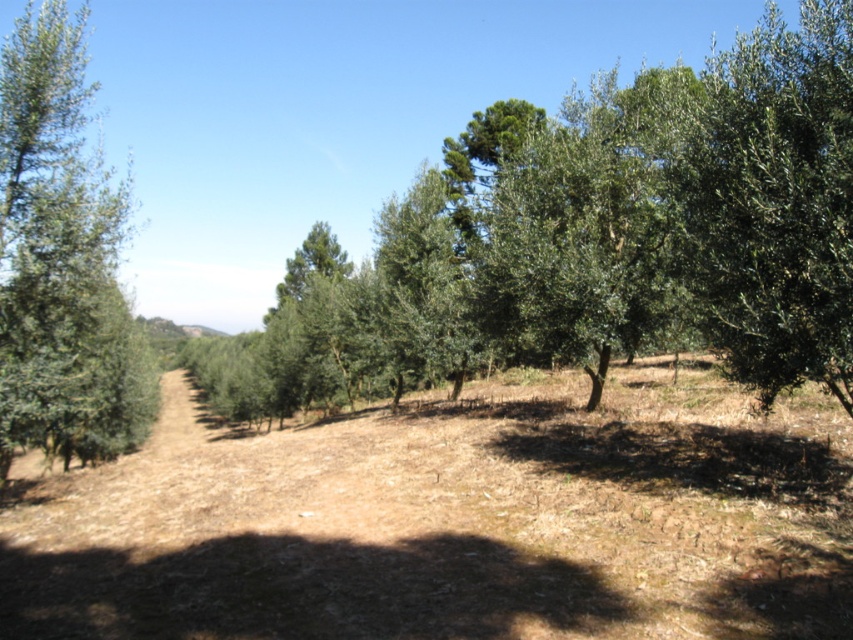
Looking at this image, you are a farmer standing between the green leafy tree at left and the green leafy tree at right. You want to walk directly to the tree that is farther away from you. Which tree should you walk towards?

The distance between the green leafy tree at right and green leafy tree at left is 33.69 meters. Since you are standing between them, the tree farther away would be either the one on the left or right depending on your exact position. However, without knowing your exact position between them, it is impossible to determine which is farther. Please provide more information about your location between the two trees.